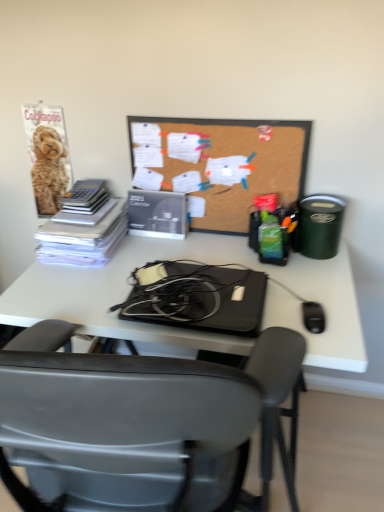
Question: In the image, is black matte laptop at center on the left side or the right side of white paper stack at left?

Choices:
 (A) left
 (B) right

Answer: (B)

Question: From the image's perspective, is black matte laptop at center positioned above or below white paper stack at left?

Choices:
 (A) below
 (B) above

Answer: (A)

Question: Which object is the closest to the matte black calendar at center?

Choices:
 (A) white paper stack at left
 (B) black plastic chair at center
 (C) corkboard at center
 (D) black plastic mouse at lower right
 (E) black matte laptop at center

Answer: (A)

Question: Based on their relative distances, which object is farther from the black plastic chair at center?

Choices:
 (A) white paper stack at left
 (B) black plastic mouse at lower right
 (C) black matte laptop at center
 (D) matte black calendar at center
 (E) corkboard at center

Answer: (D)